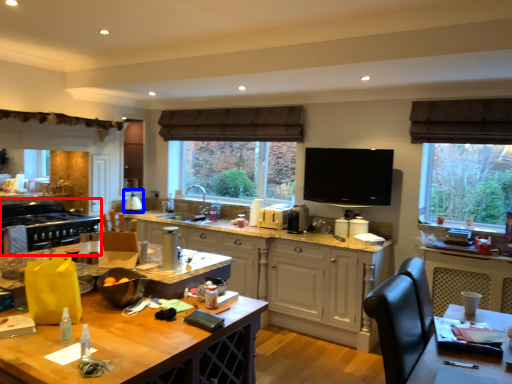
Question: Which of the following is the closest to the observer, appliance (highlighted by a red box) or appliance (highlighted by a blue box)?

Choices:
 (A) appliance
 (B) appliance

Answer: (A)